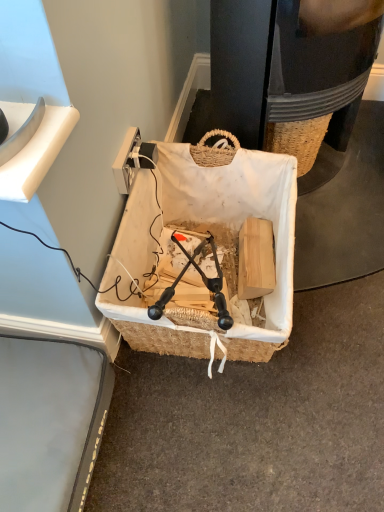
Measure the distance between point (283, 334) and camera.

Point (283, 334) and camera are 33.86 inches apart.

Identify the location of woven straw picnic basket at center. This screenshot has height=512, width=384. (215, 229).

Describe the element at coordinates (215, 229) in the screenshot. I see `woven straw picnic basket at center` at that location.

You are a GUI agent. You are given a task and a screenshot of the screen. Output one action in this format:
    pyautogui.click(x=<x>, y=<y>)
    Task: Click on the woven straw picnic basket at center
    Image resolution: width=384 pixels, height=512 pixels.
    Given the screenshot: What is the action you would take?
    pyautogui.click(x=215, y=229)